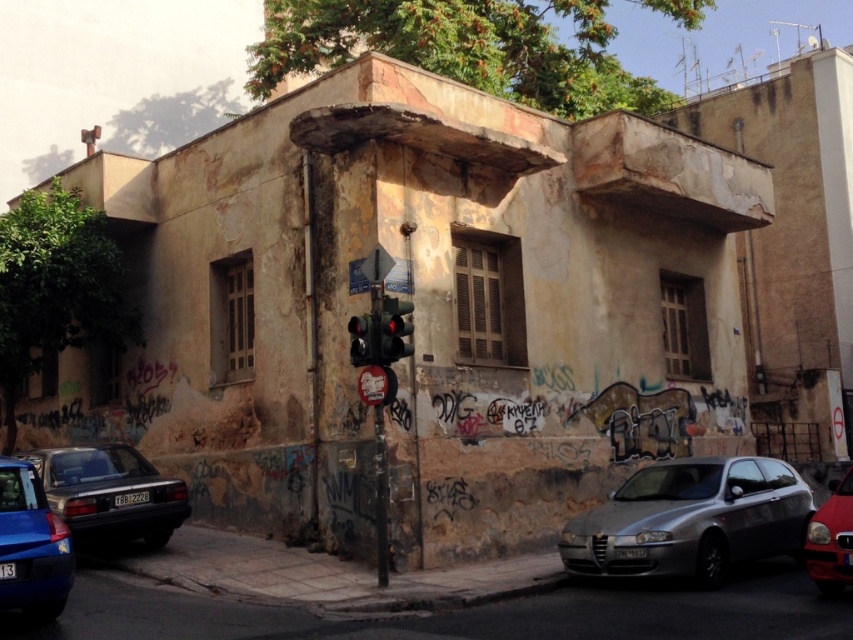
Question: Is matte red car at lower right below metallic traffic light at center?

Choices:
 (A) no
 (B) yes

Answer: (B)

Question: Which point is farther to the camera?

Choices:
 (A) matte red car at lower right
 (B) silver metallic car at center
 (C) matte black sedan at lower left
 (D) black plastic traffic light at center

Answer: (D)

Question: Among these objects, which one is nearest to the camera?

Choices:
 (A) matte red car at lower right
 (B) metallic blue sedan at lower left

Answer: (B)

Question: Is matte black sedan at lower left positioned in front of metallic traffic light at center?

Choices:
 (A) no
 (B) yes

Answer: (B)

Question: Among these points, which one is farthest from the camera?

Choices:
 (A) (28, 512)
 (B) (358, 348)
 (C) (685, 477)

Answer: (C)

Question: Is matte black sedan at lower left below metallic traffic light at center?

Choices:
 (A) yes
 (B) no

Answer: (A)